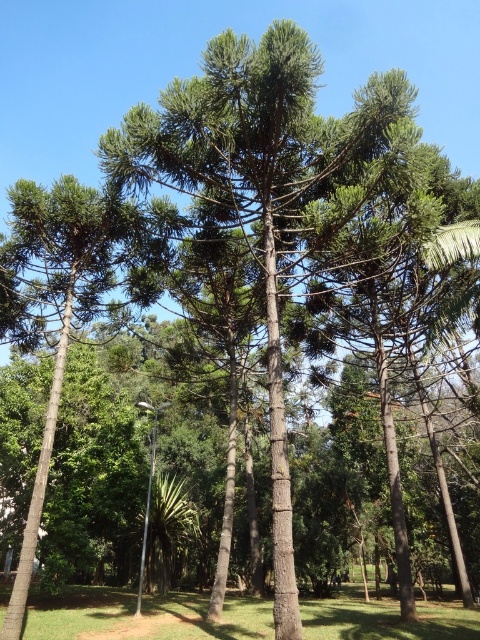
Does green textured pine tree at center appear over green grass at lower center?

Correct, green textured pine tree at center is located above green grass at lower center.

Between point (74, 269) and point (311, 634), which one is positioned behind?

Point (74, 269)

Is point (101, 264) farther from camera compared to point (84, 634)?

Yes, point (101, 264) is farther from viewer.

Where is `green textured pine tree at center`? green textured pine tree at center is located at coordinates click(60, 305).